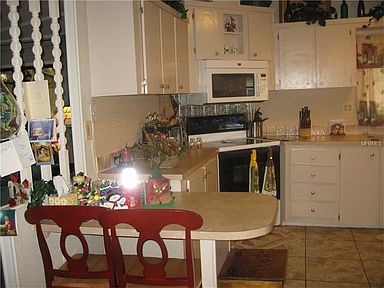
You are a GUI agent. You are given a task and a screenshot of the screen. Output one action in this format:
    pyautogui.click(x=<x>, y=<y>)
    Task: Click on the white kitchen drawer
    This screenshot has height=288, width=384.
    Given the screenshot: What is the action you would take?
    coord(324,157)